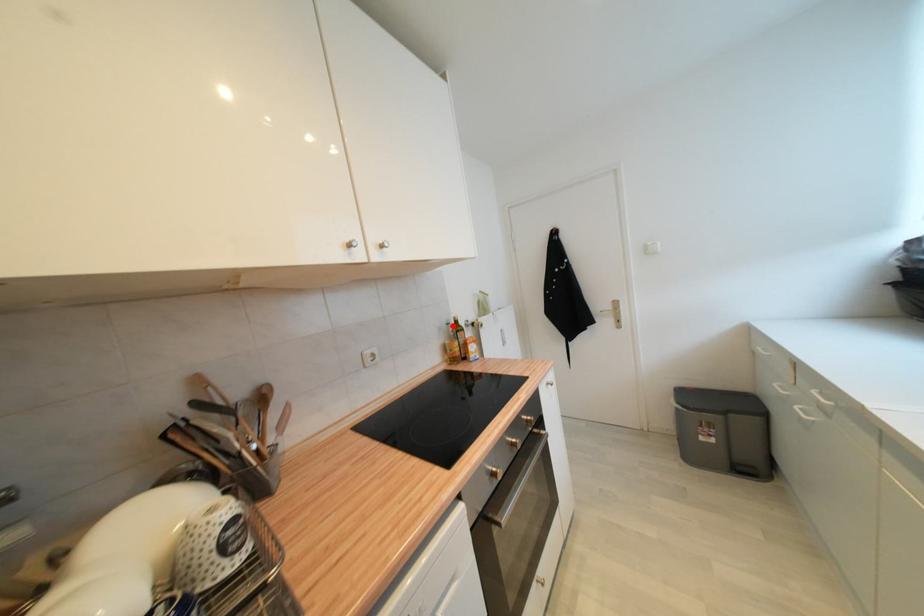
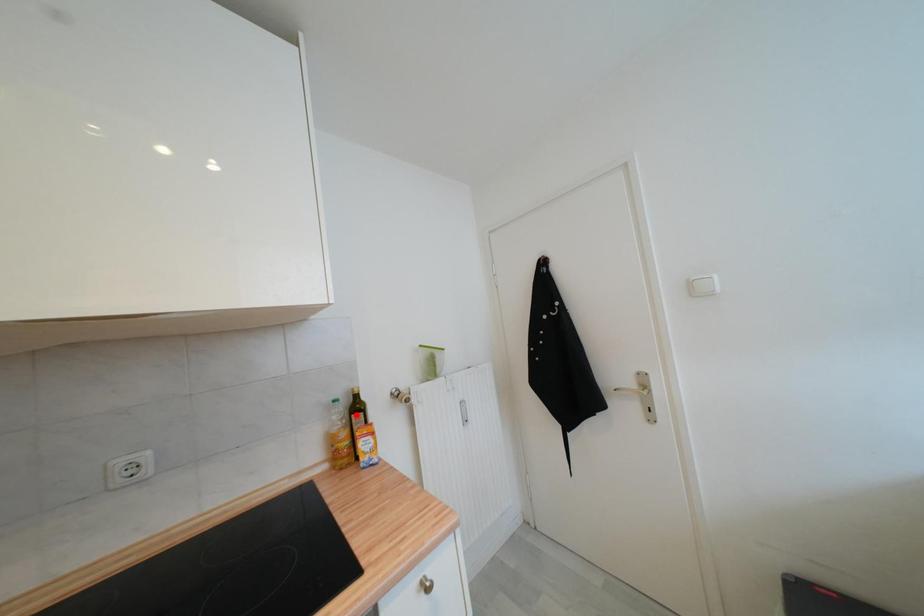
I am providing you with two images of the same scene from different viewpoints. A red point is marked on the first image and another point is marked on the second image. Are the points marked in image1 and image2 representing the same 3D position?

No